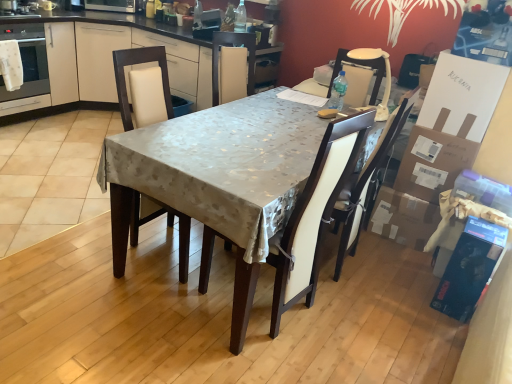
Locate an element on the screen. matte white chair at center, which appears as the first chair when viewed from the left is located at coordinates (139, 63).

Locate an element on the screen. matte white chair at center, placed as the third chair when sorted from right to left is located at coordinates (139, 63).

From their relative heights in the image, would you say matte white chair at center, which appears as the first chair when viewed from the left, is taller or shorter than matte white oven at left?

In the image, matte white chair at center, which appears as the first chair when viewed from the left, appears to be taller than matte white oven at left.

From the picture: Considering the relative positions of matte white chair at center, placed as the third chair when sorted from right to left, and matte white oven at left in the image provided, is matte white chair at center, placed as the third chair when sorted from right to left, to the left or to the right of matte white oven at left?

From the image, it's evident that matte white chair at center, placed as the third chair when sorted from right to left, is to the right of matte white oven at left.

Locate an element on the screen. The image size is (512, 384). oven positioned vertically above the matte white chair at center, placed as the third chair when sorted from right to left (from a real-world perspective) is located at coordinates (27, 61).

From the image's perspective, is matte white chair at center, which appears as the first chair when viewed from the left, on matte white oven at left?

Actually, matte white chair at center, which appears as the first chair when viewed from the left, appears below matte white oven at left in the image.

Which of these two, brown cardboard box at lower right, marked as the second cardboard box in a top-to-bottom arrangement, or matte white oven at left, is bigger?

With larger size is matte white oven at left.

Is brown cardboard box at lower right, marked as the second cardboard box in a top-to-bottom arrangement, oriented away from matte white oven at left?

brown cardboard box at lower right, marked as the second cardboard box in a top-to-bottom arrangement, is not turned away from matte white oven at left.

Which of these two, brown cardboard box at lower right, the 1th cardboard box ordered from the bottom, or matte white oven at left, stands shorter?

brown cardboard box at lower right, the 1th cardboard box ordered from the bottom.

Is matte white oven at left behind white leather chair at center, placed as the second chair when sorted from left to right?

Yes, it is.

Is matte white oven at left facing away from white leather chair at center, the 2th chair in the right-to-left sequence?

That's not correct — matte white oven at left is not looking away from white leather chair at center, the 2th chair in the right-to-left sequence.

From the image's perspective, relative to white leather chair at center, placed as the second chair when sorted from left to right, is matte white oven at left above or below?

Based on their image positions, matte white oven at left is located above white leather chair at center, placed as the second chair when sorted from left to right.

From the image's perspective, is beige fabric chair at upper right, the 3th chair positioned from the left, under cardboard box at right, which appears as the second cardboard box when ordered from the bottom?

Actually, beige fabric chair at upper right, the 3th chair positioned from the left, appears above cardboard box at right, which appears as the second cardboard box when ordered from the bottom, in the image.

Is beige fabric chair at upper right, the 3th chair positioned from the left, wider or thinner than cardboard box at right, which is counted as the first cardboard box, starting from the top?

Considering their sizes, beige fabric chair at upper right, the 3th chair positioned from the left, looks slimmer than cardboard box at right, which is counted as the first cardboard box, starting from the top.

Could you tell me if beige fabric chair at upper right, the 3th chair positioned from the left, is facing cardboard box at right, which is counted as the first cardboard box, starting from the top?

No, beige fabric chair at upper right, the 3th chair positioned from the left, is not oriented towards cardboard box at right, which is counted as the first cardboard box, starting from the top.

Is beige fabric chair at upper right, arranged as the 1th chair when viewed from the right, to the right of cardboard box at right, which is counted as the first cardboard box, starting from the top, from the viewer's perspective?

No.

I want to click on the 2nd chair directly above the matte white chair at center, placed as the third chair when sorted from right to left (from a real-world perspective), so click(x=361, y=65).

Which point is more distant from viewer, (362, 65) or (128, 54)?

Point (362, 65)

Is beige fabric chair at upper right, the 3th chair positioned from the left, positioned behind matte white chair at center, placed as the third chair when sorted from right to left?

Yes, the depth of beige fabric chair at upper right, the 3th chair positioned from the left, is greater than that of matte white chair at center, placed as the third chair when sorted from right to left.

Is beige fabric chair at upper right, the 3th chair positioned from the left, positioned beyond the bounds of matte white chair at center, which appears as the first chair when viewed from the left?

That's correct, beige fabric chair at upper right, the 3th chair positioned from the left, is outside of matte white chair at center, which appears as the first chair when viewed from the left.

Looking at this image, which is behind, matte white oven at left or satin silver microwave at upper center?

satin silver microwave at upper center is further from the camera.

Is matte white oven at left not close to satin silver microwave at upper center?

No, matte white oven at left is in close proximity to satin silver microwave at upper center.

Is matte white oven at left facing towards satin silver microwave at upper center?

No.

Does matte white oven at left appear on the right side of satin silver microwave at upper center?

No, matte white oven at left is not to the right of satin silver microwave at upper center.

The width and height of the screenshot is (512, 384). In order to click on oven above the cardboard box at right, which is counted as the first cardboard box, starting from the top (from the image's perspective) in this screenshot , I will do `click(27, 61)`.

Is point (419, 197) more distant than point (40, 28)?

No, (419, 197) is in front of (40, 28).

Is cardboard box at right, which is counted as the first cardboard box, starting from the top, thinner than matte white oven at left?

Yes, cardboard box at right, which is counted as the first cardboard box, starting from the top, is thinner than matte white oven at left.

Considering the relative positions of cardboard box at right, which appears as the second cardboard box when ordered from the bottom, and matte white oven at left in the image provided, is cardboard box at right, which appears as the second cardboard box when ordered from the bottom, to the left or to the right of matte white oven at left?

Clearly, cardboard box at right, which appears as the second cardboard box when ordered from the bottom, is on the right of matte white oven at left in the image.

Image resolution: width=512 pixels, height=384 pixels. What are the coordinates of `oven located behind the matte white chair at center, which appears as the first chair when viewed from the left` in the screenshot? It's located at (27, 61).

Find the location of a particular element. The width and height of the screenshot is (512, 384). oven that is on the left side of brown cardboard box at lower right, marked as the second cardboard box in a top-to-bottom arrangement is located at coordinates (27, 61).

Which object lies further to the anchor point matte white chair at center, placed as the third chair when sorted from right to left, cardboard box at right, which is counted as the first cardboard box, starting from the top, or white leather chair at center, the 2th chair in the right-to-left sequence?

cardboard box at right, which is counted as the first cardboard box, starting from the top, is further to matte white chair at center, placed as the third chair when sorted from right to left.

In the scene shown: Based on their spatial positions, is cardboard box at right, which is counted as the first cardboard box, starting from the top, or satin silver microwave at upper center further from beige fabric chair at upper right, arranged as the 1th chair when viewed from the right?

The object further to beige fabric chair at upper right, arranged as the 1th chair when viewed from the right, is satin silver microwave at upper center.

Based on their spatial positions, is matte white oven at left or satin silver microwave at upper center further from beige fabric chair at upper right, arranged as the 1th chair when viewed from the right?

matte white oven at left is positioned further to the anchor beige fabric chair at upper right, arranged as the 1th chair when viewed from the right.

From the image, which object appears to be nearer to beige fabric chair at upper right, the 3th chair positioned from the left, brown cardboard box at lower right, marked as the second cardboard box in a top-to-bottom arrangement, or satin silver microwave at upper center?

The object closer to beige fabric chair at upper right, the 3th chair positioned from the left, is brown cardboard box at lower right, marked as the second cardboard box in a top-to-bottom arrangement.

From the image, which object appears to be farther from white leather chair at center, placed as the second chair when sorted from left to right, cardboard box at right, which is counted as the first cardboard box, starting from the top, or matte white chair at center, placed as the third chair when sorted from right to left?

The object further to white leather chair at center, placed as the second chair when sorted from left to right, is cardboard box at right, which is counted as the first cardboard box, starting from the top.

Which object lies nearer to the anchor point satin silver microwave at upper center, matte white oven at left or matte white chair at center, which appears as the first chair when viewed from the left?

matte white oven at left is positioned closer to the anchor satin silver microwave at upper center.

Considering their positions, is brown cardboard box at lower right, marked as the second cardboard box in a top-to-bottom arrangement, positioned closer to matte white chair at center, which appears as the first chair when viewed from the left, than cardboard box at right, which appears as the second cardboard box when ordered from the bottom?

brown cardboard box at lower right, marked as the second cardboard box in a top-to-bottom arrangement, is positioned closer to the anchor matte white chair at center, which appears as the first chair when viewed from the left.

From the image, which object appears to be nearer to matte white chair at center, which appears as the first chair when viewed from the left, matte white oven at left or beige fabric chair at upper right, the 3th chair positioned from the left?

beige fabric chair at upper right, the 3th chair positioned from the left, lies closer to matte white chair at center, which appears as the first chair when viewed from the left, than the other object.

This screenshot has width=512, height=384. Identify the location of cardboard box situated between satin silver microwave at upper center and cardboard box at right, which is counted as the first cardboard box, starting from the top, from left to right. (403, 218).

Find the location of a particular element. The width and height of the screenshot is (512, 384). chair located between matte white chair at center, placed as the third chair when sorted from right to left, and beige fabric chair at upper right, the 3th chair positioned from the left, in the left-right direction is located at coordinates (314, 215).

What are the coordinates of `cardboard box between beige fabric chair at upper right, the 3th chair positioned from the left, and brown cardboard box at lower right, marked as the second cardboard box in a top-to-bottom arrangement, in the vertical direction` in the screenshot? It's located at (435, 158).

The height and width of the screenshot is (384, 512). Identify the location of oven between matte white chair at center, placed as the third chair when sorted from right to left, and satin silver microwave at upper center, along the z-axis. (27, 61).